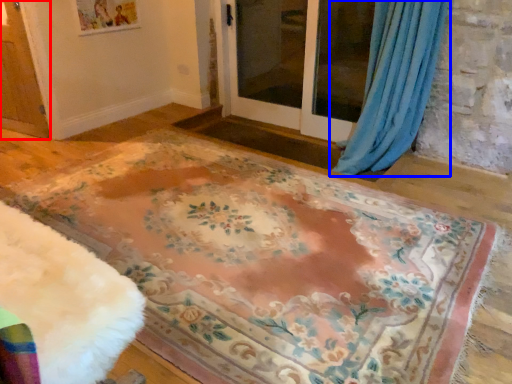
Question: Among these objects, which one is nearest to the camera, screen door (highlighted by a red box) or curtain (highlighted by a blue box)?

Choices:
 (A) screen door
 (B) curtain

Answer: (B)